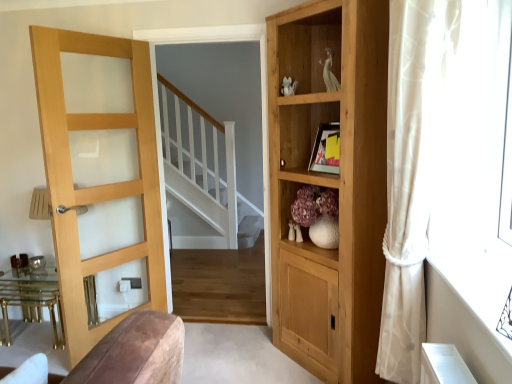
Question: Can you confirm if light wood/glass door at left is wider than white matte vase at center?

Choices:
 (A) yes
 (B) no

Answer: (B)

Question: Is light wood/glass door at left looking in the opposite direction of white matte vase at center?

Choices:
 (A) no
 (B) yes

Answer: (A)

Question: Is the depth of light wood/glass door at left less than that of white matte vase at center?

Choices:
 (A) no
 (B) yes

Answer: (B)

Question: From the image's perspective, is light wood/glass door at left above white matte vase at center?

Choices:
 (A) no
 (B) yes

Answer: (B)

Question: Would you consider light wood/glass door at left to be distant from white matte vase at center?

Choices:
 (A) yes
 (B) no

Answer: (A)

Question: Can you confirm if light wood/glass door at left is shorter than white matte vase at center?

Choices:
 (A) no
 (B) yes

Answer: (A)

Question: Is light wood/glass door at left taller than natural wood cupboard at right?

Choices:
 (A) no
 (B) yes

Answer: (A)

Question: Is light wood/glass door at left aimed at natural wood cupboard at right?

Choices:
 (A) no
 (B) yes

Answer: (A)

Question: From the image's perspective, would you say light wood/glass door at left is positioned over natural wood cupboard at right?

Choices:
 (A) no
 (B) yes

Answer: (A)

Question: Is the surface of light wood/glass door at left in direct contact with natural wood cupboard at right?

Choices:
 (A) yes
 (B) no

Answer: (B)

Question: From a real-world perspective, is light wood/glass door at left positioned under natural wood cupboard at right based on gravity?

Choices:
 (A) no
 (B) yes

Answer: (B)

Question: From a real-world perspective, is light wood/glass door at left on natural wood cupboard at right?

Choices:
 (A) no
 (B) yes

Answer: (A)

Question: Is white matte vase at center facing towards light wood/glass door at left?

Choices:
 (A) yes
 (B) no

Answer: (B)